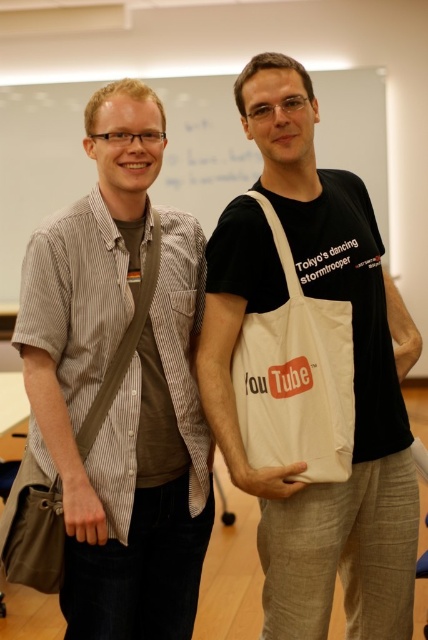
Which is in front, point (324, 120) or point (222, 237)?

Positioned in front is point (222, 237).

Is white matte board at upper center closer to the viewer compared to white cotton tote bag at center?

No.

At what (x,y) coordinates should I click in order to perform the action: click on white matte board at upper center. Please return your answer as a coordinate pair (x, y). This screenshot has height=640, width=428. Looking at the image, I should click on (36, 164).

The height and width of the screenshot is (640, 428). In order to click on white matte board at upper center in this screenshot , I will do `click(36, 164)`.

Is white matte board at upper center in front of white canvas tote bag at center?

No, it is behind white canvas tote bag at center.

Which is behind, point (235, 195) or point (273, 429)?

The point (235, 195) is behind.

This screenshot has height=640, width=428. In order to click on white matte board at upper center in this screenshot , I will do `click(36, 164)`.

Is striped cotton shirt at left thinner than white matte board at upper center?

Yes.

Does striped cotton shirt at left have a smaller size compared to white matte board at upper center?

Yes.

This screenshot has width=428, height=640. Describe the element at coordinates (113, 396) in the screenshot. I see `striped cotton shirt at left` at that location.

Locate an element on the screen. The image size is (428, 640). striped cotton shirt at left is located at coordinates (113, 396).